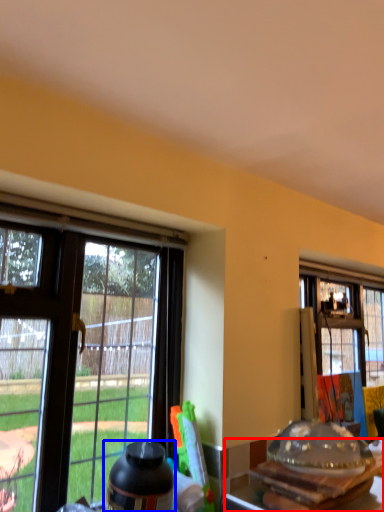
Question: Which object is closer to the camera taking this photo, kitchen & dining room table (highlighted by a red box) or bottle (highlighted by a blue box)?

Choices:
 (A) kitchen & dining room table
 (B) bottle

Answer: (A)